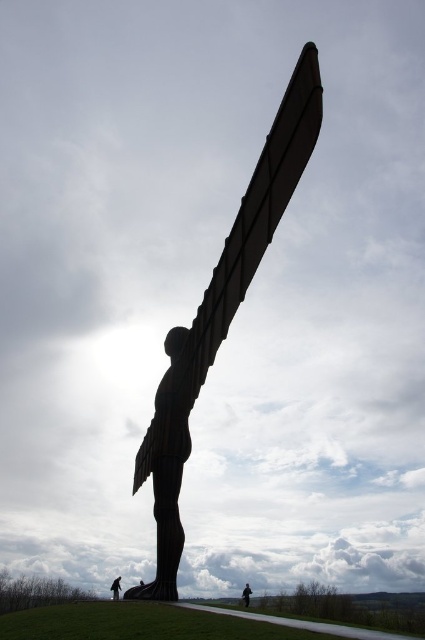
You are a visitor at an outdoor art exhibition and want to take a photo of the black polished statue at center with the dark brown leather jacket at lower center in the foreground. Will the statue be fully visible in the photo if the jacket is placed right in front of it?

The black polished statue at center is much taller than the dark brown leather jacket at lower center, so the statue will still be fully visible in the photo even if the jacket is placed right in front of it.

You are standing at the camera position and want to take a photo of the black polished statue at center. If your camera has a maximum zoom range of 10 meters, will you be able to capture the statue clearly without moving closer?

The black polished statue at center and camera are 16.88 meters apart from each other. Since the maximum zoom range is 10 meters, the camera cannot capture the statue clearly without moving closer.